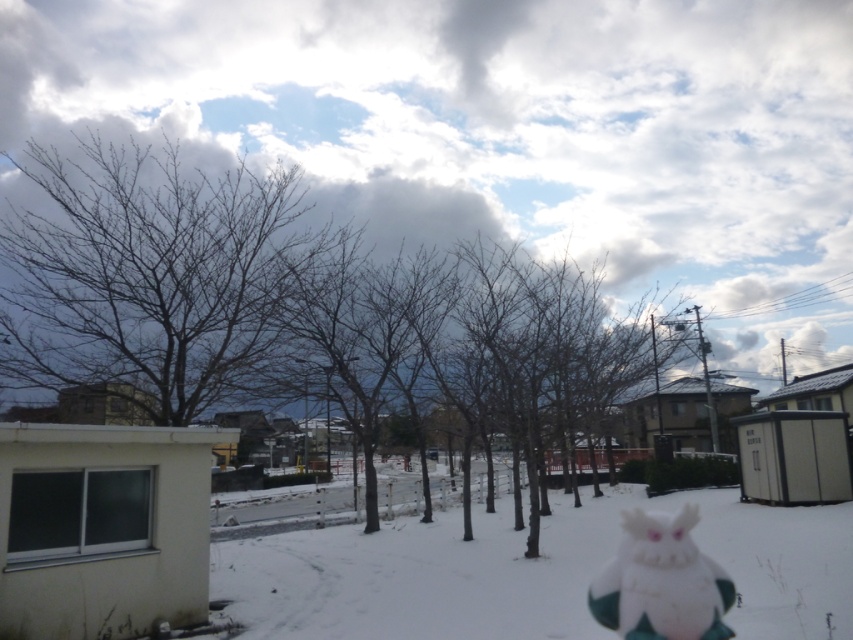
Question: Which is farther from the white plush at center?

Choices:
 (A) bare branches at left
 (B) white fluffy snow at center

Answer: (A)

Question: Which point is closer to the camera?

Choices:
 (A) 544,580
 (B) 724,609

Answer: (B)

Question: Considering the relative positions of white fluffy snow at center and white plush at center in the image provided, where is white fluffy snow at center located with respect to white plush at center?

Choices:
 (A) left
 (B) right

Answer: (B)

Question: From the image, what is the correct spatial relationship of bare branches at left in relation to white fluffy snow at center?

Choices:
 (A) right
 (B) left

Answer: (B)

Question: Which point appears closest to the camera in this image?

Choices:
 (A) (680, 628)
 (B) (614, 541)
 (C) (241, 170)

Answer: (A)

Question: Is bare branches at left behind white fluffy snow at center?

Choices:
 (A) yes
 (B) no

Answer: (A)